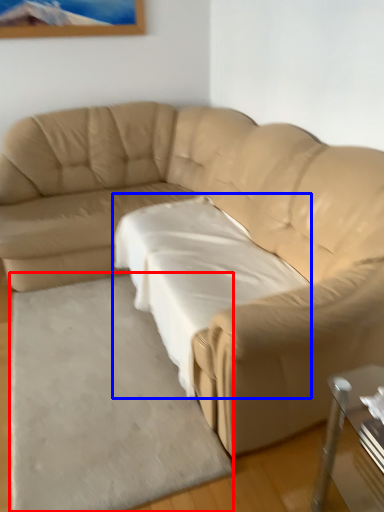
Question: Among these objects, which one is nearest to the camera, mat (highlighted by a red box) or sheet (highlighted by a blue box)?

Choices:
 (A) mat
 (B) sheet

Answer: (A)